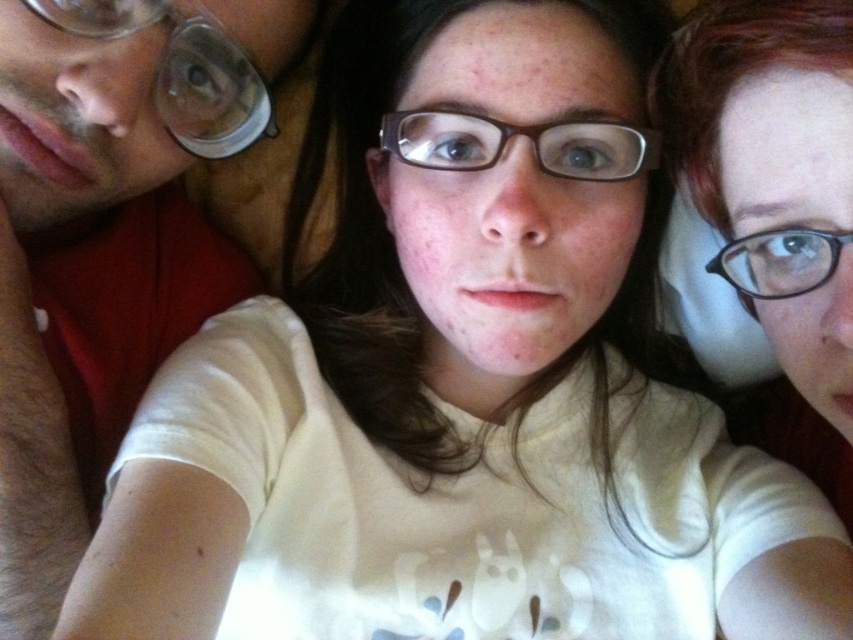
Question: Which of the following is the closest to the observer?

Choices:
 (A) brown plastic glasses at center
 (B) matte red shirt at left

Answer: (B)

Question: Which object is positioned closest to the clear plastic glasses at upper right?

Choices:
 (A) matte red shirt at left
 (B) brown plastic glasses at center

Answer: (B)

Question: Can you confirm if brown plastic glasses at center is smaller than clear plastic glasses at upper right?

Choices:
 (A) no
 (B) yes

Answer: (A)

Question: Which point is farther from the camera taking this photo?

Choices:
 (A) (828, 252)
 (B) (62, 592)
 (C) (590, 150)
 (D) (62, 17)

Answer: (C)

Question: Does brown plastic glasses at center have a smaller size compared to clear plastic glasses at upper right?

Choices:
 (A) no
 (B) yes

Answer: (A)

Question: Does matte red shirt at left have a smaller size compared to clear plastic glasses at upper right?

Choices:
 (A) yes
 (B) no

Answer: (B)